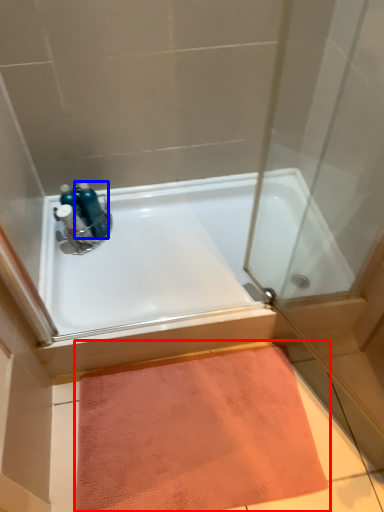
Question: Which of the following is the closest to the observer, doormat (highlighted by a red box) or bottle (highlighted by a blue box)?

Choices:
 (A) doormat
 (B) bottle

Answer: (A)